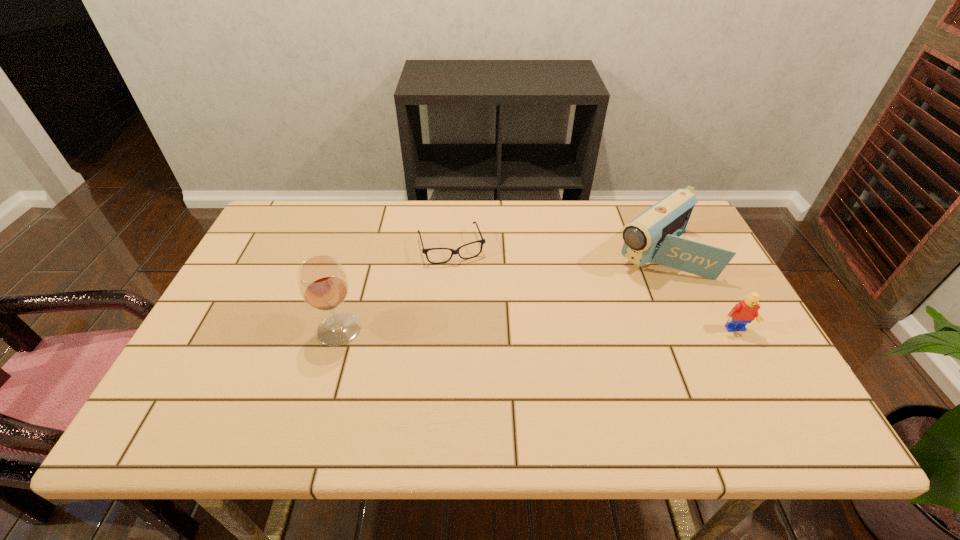
Identify the location of wineglass. The height and width of the screenshot is (540, 960). point(323,284).

Image resolution: width=960 pixels, height=540 pixels. I want to click on the leftmost object, so click(x=323, y=284).

Locate an element on the screen. The width and height of the screenshot is (960, 540). Lego is located at coordinates (744, 312).

You are a GUI agent. You are given a task and a screenshot of the screen. Output one action in this format:
    pyautogui.click(x=<x>, y=<y>)
    Task: Click on the shortest object
    This screenshot has width=960, height=540.
    Given the screenshot: What is the action you would take?
    pyautogui.click(x=453, y=252)

You are a GUI agent. You are given a task and a screenshot of the screen. Output one action in this format:
    pyautogui.click(x=<x>, y=<y>)
    Task: Click on the third object from right to left
    Image resolution: width=960 pixels, height=540 pixels.
    Given the screenshot: What is the action you would take?
    pyautogui.click(x=453, y=252)

Find the location of a particular element. the second tallest object is located at coordinates (653, 236).

You are a GUI agent. You are given a task and a screenshot of the screen. Output one action in this format:
    pyautogui.click(x=<x>, y=<y>)
    Task: Click on the free space located 0.140m on the right of the tallest object
    
    Given the screenshot: What is the action you would take?
    click(418, 330)

The image size is (960, 540). In order to click on free space located 0.080m on the front-facing side of the Lego in this screenshot , I will do 752,364.

Locate an element on the screen. This screenshot has height=540, width=960. blank space located 0.140m on the front-facing side of the spectacles is located at coordinates (470, 299).

Locate an element on the screen. The image size is (960, 540). vacant space situated on the front-facing side of the spectacles is located at coordinates (487, 350).